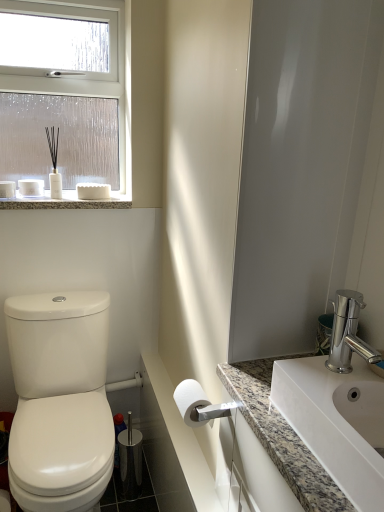
The image size is (384, 512). Identify the location of granite countertop at lower right, the second counter top positioned from the left. (281, 436).

Measure the distance between white glossy toilet at left and camera.

white glossy toilet at left is 1.22 meters from camera.

This screenshot has height=512, width=384. Describe the element at coordinates (64, 201) in the screenshot. I see `granite countertop at upper left` at that location.

The image size is (384, 512). What do you see at coordinates (181, 437) in the screenshot?
I see `white marble countertop at lower center, acting as the 1th counter top starting from the left` at bounding box center [181, 437].

Where is `polished chrome faucet at right`? The height and width of the screenshot is (512, 384). polished chrome faucet at right is located at coordinates (348, 333).

I want to click on white glossy sink at right, so click(x=339, y=407).

I want to click on granite countertop at lower right, the second counter top positioned from the left, so click(x=281, y=436).

Which is closer, [351,360] or [106,18]?

The point [351,360] is closer.

Between white glossy sink at right and clear glass window at upper left, which one has larger size?

clear glass window at upper left is bigger.

From the image's perspective, which is above, white glossy sink at right or clear glass window at upper left?

clear glass window at upper left is shown above in the image.

In the scene shown: Can you confirm if white glossy toilet at left is positioned to the left of granite countertop at lower right, the second counter top positioned from the left?

Indeed, white glossy toilet at left is positioned on the left side of granite countertop at lower right, the second counter top positioned from the left.

Which of these two, white glossy toilet at left or granite countertop at lower right, the 1th counter top from the right, is bigger?

With larger size is white glossy toilet at left.

Can you confirm if white glossy toilet at left is wider than granite countertop at lower right, the second counter top positioned from the left?

Yes, white glossy toilet at left is wider than granite countertop at lower right, the second counter top positioned from the left.

How many degrees apart are the facing directions of white glossy toilet at left and granite countertop at lower right, the second counter top positioned from the left?

There is a 92.4-degree angle between the facing directions of white glossy toilet at left and granite countertop at lower right, the second counter top positioned from the left.

Which of these two, clear glass window at upper left or white plastic towel bar at lower center, is wider?

clear glass window at upper left is wider.

From the image's perspective, is clear glass window at upper left located beneath white plastic towel bar at lower center?

Incorrect, from the image's perspective, clear glass window at upper left is higher than white plastic towel bar at lower center.

Considering the sizes of clear glass window at upper left and white plastic towel bar at lower center in the image, is clear glass window at upper left taller or shorter than white plastic towel bar at lower center?

In the image, clear glass window at upper left appears to be taller than white plastic towel bar at lower center.

Is white plastic towel bar at lower center completely or partially inside clear glass window at upper left?

No, white plastic towel bar at lower center is located outside of clear glass window at upper left.

Is white plastic towel bar at lower center surrounded by white glossy sink at right?

That's incorrect, white plastic towel bar at lower center is not inside white glossy sink at right.

Between white glossy sink at right and white plastic towel bar at lower center, which one has larger size?

white glossy sink at right is bigger.

Are white glossy sink at right and white plastic towel bar at lower center located far from each other?

white glossy sink at right is positioned a significant distance from white plastic towel bar at lower center.

Can you confirm if white marble countertop at lower center, the 2th counter top in the right-to-left sequence, is positioned to the left of white glossy toilet at left?

Incorrect, white marble countertop at lower center, the 2th counter top in the right-to-left sequence, is not on the left side of white glossy toilet at left.

Does point (204, 504) lie in front of point (100, 346)?

Yes, it is in front of point (100, 346).

From a real-world perspective, relative to white glossy toilet at left, is white marble countertop at lower center, the 2th counter top in the right-to-left sequence, vertically above or below?

Clearly, from a real-world perspective, white marble countertop at lower center, the 2th counter top in the right-to-left sequence, is above white glossy toilet at left.

Is white marble countertop at lower center, the 2th counter top in the right-to-left sequence, aimed at white glossy toilet at left?

Yes, white marble countertop at lower center, the 2th counter top in the right-to-left sequence, is facing white glossy toilet at left.

From the image's perspective, is granite countertop at upper left located above or below white glossy toilet at left?

Clearly, from the image's perspective, granite countertop at upper left is above white glossy toilet at left.

From a real-world perspective, is granite countertop at upper left on top of white glossy toilet at left?

Yes, from a real-world perspective, granite countertop at upper left is on top of white glossy toilet at left.

Is granite countertop at upper left aimed at white glossy toilet at left?

No, granite countertop at upper left is not turned towards white glossy toilet at left.

Could you tell me if white matte toilet paper at center is facing white plastic towel bar at lower center?

No, white matte toilet paper at center does not turn towards white plastic towel bar at lower center.

Consider the image. Is white matte toilet paper at center behind white plastic towel bar at lower center?

No, white matte toilet paper at center is in front of white plastic towel bar at lower center.

From the image's perspective, which one is positioned higher, white matte toilet paper at center or white plastic towel bar at lower center?

white matte toilet paper at center.

Is white matte toilet paper at center positioned far away from white plastic towel bar at lower center?

white matte toilet paper at center is actually quite close to white plastic towel bar at lower center.

The width and height of the screenshot is (384, 512). I want to click on window located on the left of white glossy sink at right, so click(x=86, y=72).

Where is `toilet behind the granite countertop at lower right, the 1th counter top from the right`? The image size is (384, 512). toilet behind the granite countertop at lower right, the 1th counter top from the right is located at coordinates (59, 400).

Looking at the image, which one is located further to white glossy toilet at left, white matte toilet paper at center or white marble countertop at lower center, the 2th counter top in the right-to-left sequence?

Based on the image, white matte toilet paper at center appears to be further to white glossy toilet at left.

Looking at the image, which one is located closer to white glossy sink at right, white glossy toilet at left or white matte toilet paper at center?

white matte toilet paper at center.

Estimate the real-world distances between objects in this image. Which object is further from granite countertop at upper left, white matte toilet paper at center or clear glass window at upper left?

Based on the image, white matte toilet paper at center appears to be further to granite countertop at upper left.

Looking at this image, which object lies nearer to the anchor point granite countertop at upper left, white glossy toilet at left or white marble countertop at lower center, the 2th counter top in the right-to-left sequence?

The object closer to granite countertop at upper left is white glossy toilet at left.

When comparing their distances from clear glass window at upper left, does white plastic towel bar at lower center or granite countertop at upper left seem further?

The object further to clear glass window at upper left is white plastic towel bar at lower center.

Considering their positions, is white glossy sink at right positioned further to white glossy toilet at left than white plastic towel bar at lower center?

white glossy sink at right is further to white glossy toilet at left.

Estimate the real-world distances between objects in this image. Which object is closer to white glossy sink at right, clear glass window at upper left or white glossy toilet at left?

The object closer to white glossy sink at right is white glossy toilet at left.

When comparing their distances from polished chrome faucet at right, does granite countertop at lower right, the 1th counter top from the right, or white matte toilet paper at center seem closer?

granite countertop at lower right, the 1th counter top from the right.

Locate an element on the screen. tap positioned between granite countertop at lower right, the 1th counter top from the right, and white marble countertop at lower center, acting as the 1th counter top starting from the left, from near to far is located at coordinates (348, 333).

Identify the location of sink between granite countertop at upper left and polished chrome faucet at right. The image size is (384, 512). (339, 407).

What are the coordinates of `toilet paper located between white glossy sink at right and white plastic towel bar at lower center in the depth direction` in the screenshot? It's located at (191, 402).

The height and width of the screenshot is (512, 384). I want to click on tap between granite countertop at lower right, the second counter top positioned from the left, and white matte toilet paper at center in the front-back direction, so click(x=348, y=333).